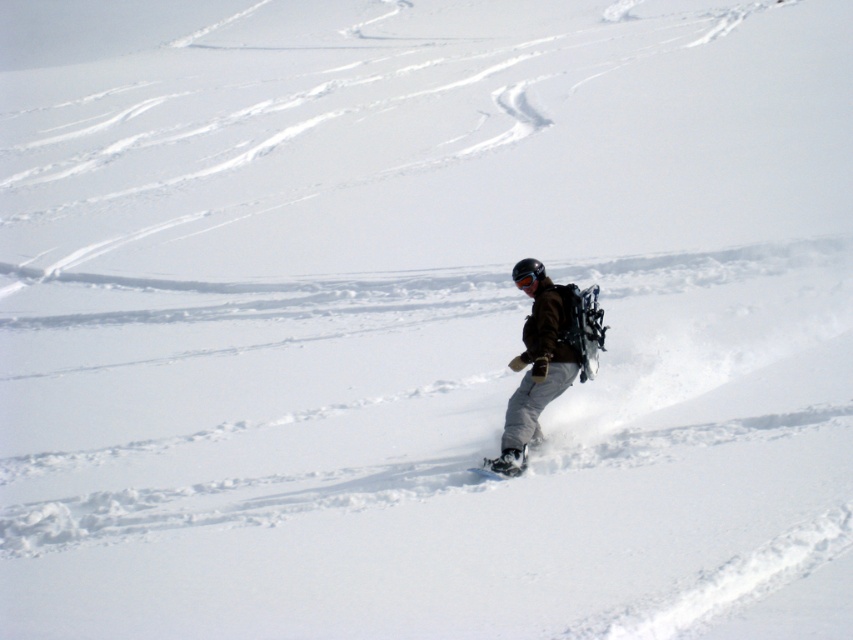
You are standing at the bottom of the slope and want to reach the point marked at coordinates point (x=552, y=288). If your maximum walking distance is 40 feet, can you reach it without using any equipment?

The point (x=552, y=288) is 39.93 feet away from the viewer, so yes, you can reach it within your maximum walking distance of 40 feet.

You are a photographer trying to capture the snowboarder. You need to decide whether to focus on the dark brown jacket at center or the white matte snowboard at center based on their sizes. Which object should you choose if you want to ensure the larger object is in the frame?

The dark brown jacket at center might be wider than the white matte snowboard at center, so you should focus on the dark brown jacket at center to capture the larger object in the frame.